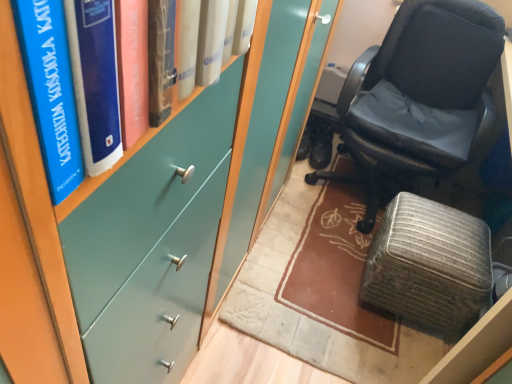
Where is `vacant area that is in front of black leather chair at right`? Image resolution: width=512 pixels, height=384 pixels. vacant area that is in front of black leather chair at right is located at coordinates (315, 281).